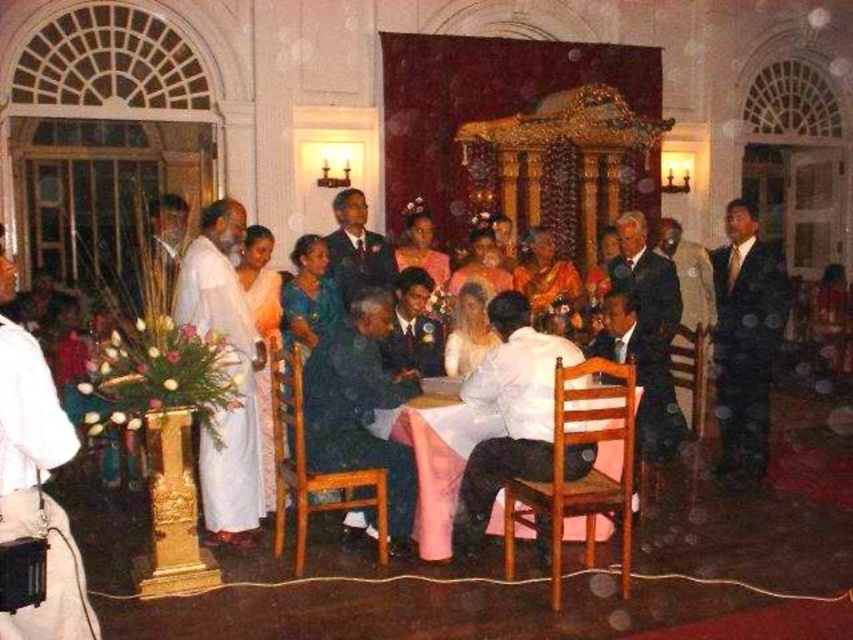
Question: Is the position of white satin dress at center more distant than that of white cloth-covered table at center?

Choices:
 (A) yes
 (B) no

Answer: (B)

Question: Can you confirm if white satin dress at center is positioned to the right of white cloth-covered table at center?

Choices:
 (A) no
 (B) yes

Answer: (B)

Question: Among these objects, which one is nearest to the camera?

Choices:
 (A) white satin dress at center
 (B) white cloth-covered table at center

Answer: (A)

Question: Which point appears farthest from the camera in this image?

Choices:
 (A) (459, 547)
 (B) (437, 410)

Answer: (A)

Question: Does white satin dress at center appear over white cloth-covered table at center?

Choices:
 (A) no
 (B) yes

Answer: (B)